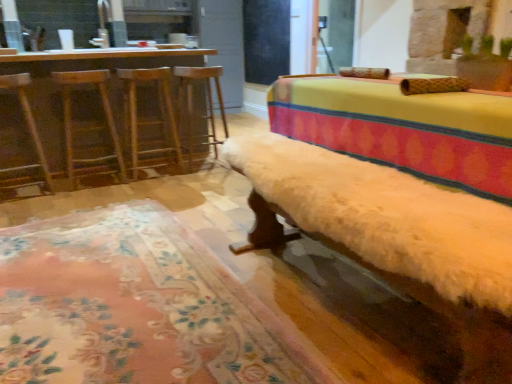
Question: From the image's perspective, is wooden bar stool at center, which is the first bar stool from right to left, under wooden swivel chair at left, arranged as the 1th swivel chair when viewed from the left?

Choices:
 (A) yes
 (B) no

Answer: (B)

Question: From a real-world perspective, is wooden bar stool at center, which is the first bar stool from right to left, over wooden swivel chair at left, marked as the 2th swivel chair in a right-to-left arrangement?

Choices:
 (A) no
 (B) yes

Answer: (A)

Question: Is wooden bar stool at center, which is the first bar stool from right to left, touching wooden swivel chair at left, arranged as the 1th swivel chair when viewed from the left?

Choices:
 (A) yes
 (B) no

Answer: (B)

Question: From the image's perspective, is wooden bar stool at center, the 2th bar stool from the left, above wooden swivel chair at left, marked as the 2th swivel chair in a right-to-left arrangement?

Choices:
 (A) yes
 (B) no

Answer: (A)

Question: Is wooden bar stool at center, which is the first bar stool from right to left, taller than wooden swivel chair at left, marked as the 2th swivel chair in a right-to-left arrangement?

Choices:
 (A) no
 (B) yes

Answer: (A)

Question: Is fuzzy white bench at center wider or thinner than fluffy beige rug at lower center?

Choices:
 (A) wide
 (B) thin

Answer: (A)

Question: Relative to fluffy beige rug at lower center, is fuzzy white bench at center in front or behind?

Choices:
 (A) front
 (B) behind

Answer: (A)

Question: Is point (273, 183) closer or farther from the camera than point (141, 309)?

Choices:
 (A) closer
 (B) farther

Answer: (A)

Question: Is fuzzy white bench at center spatially inside fluffy beige rug at lower center, or outside of it?

Choices:
 (A) outside
 (B) inside

Answer: (A)

Question: Considering the positions of wooden bar stool at left, placed as the 1th bar stool when sorted from left to right, and fluffy beige rug at lower center in the image, is wooden bar stool at left, placed as the 1th bar stool when sorted from left to right, wider or thinner than fluffy beige rug at lower center?

Choices:
 (A) thin
 (B) wide

Answer: (A)

Question: From the image's perspective, is wooden bar stool at left, the 2th bar stool from the right, positioned above or below fluffy beige rug at lower center?

Choices:
 (A) below
 (B) above

Answer: (B)

Question: From a real-world perspective, is wooden bar stool at left, placed as the 1th bar stool when sorted from left to right, positioned above or below fluffy beige rug at lower center?

Choices:
 (A) above
 (B) below

Answer: (A)

Question: Is wooden bar stool at left, placed as the 1th bar stool when sorted from left to right, to the left or to the right of fluffy beige rug at lower center in the image?

Choices:
 (A) left
 (B) right

Answer: (A)

Question: Considering the positions of wooden swivel chair at left, arranged as the 1th swivel chair when viewed from the left, and wooden bar stool at center, the 2th bar stool from the left, in the image, is wooden swivel chair at left, arranged as the 1th swivel chair when viewed from the left, wider or thinner than wooden bar stool at center, the 2th bar stool from the left,?

Choices:
 (A) thin
 (B) wide

Answer: (A)

Question: Looking at the image, does wooden swivel chair at left, arranged as the 1th swivel chair when viewed from the left, seem bigger or smaller compared to wooden bar stool at center, the 2th bar stool from the left?

Choices:
 (A) big
 (B) small

Answer: (B)